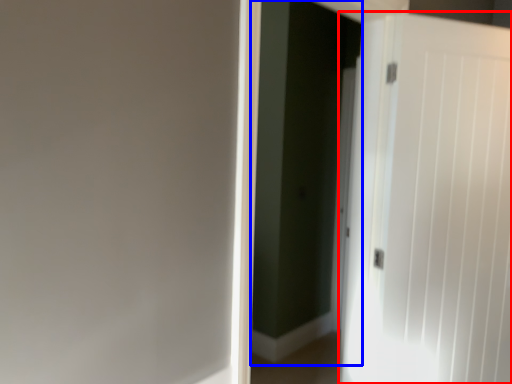
Question: Which object appears closest to the camera in this image, door (highlighted by a red box) or screen door (highlighted by a blue box)?

Choices:
 (A) door
 (B) screen door

Answer: (B)